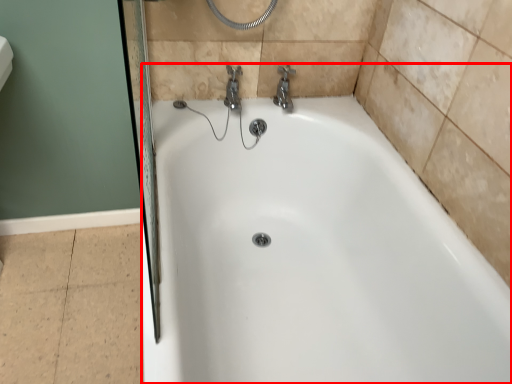
Question: From the image's perspective, what is the correct spatial relationship of bathtub (annotated by the red box) in relation to tap?

Choices:
 (A) below
 (B) above

Answer: (A)